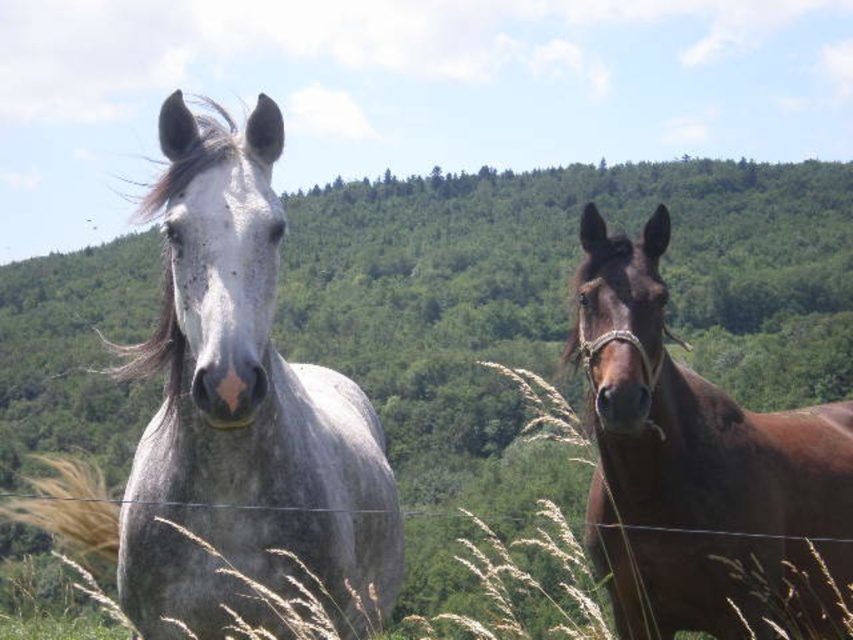
Question: Considering the relative positions of gray speckled horse at center and brown glossy horse at right in the image provided, where is gray speckled horse at center located with respect to brown glossy horse at right?

Choices:
 (A) above
 (B) below

Answer: (A)

Question: Which object is farther from the camera taking this photo?

Choices:
 (A) brown glossy horse at right
 (B) gray speckled horse at center

Answer: (A)

Question: Does gray speckled horse at center have a lesser width compared to brown glossy horse at right?

Choices:
 (A) no
 (B) yes

Answer: (B)

Question: Does gray speckled horse at center come behind brown glossy horse at right?

Choices:
 (A) yes
 (B) no

Answer: (B)